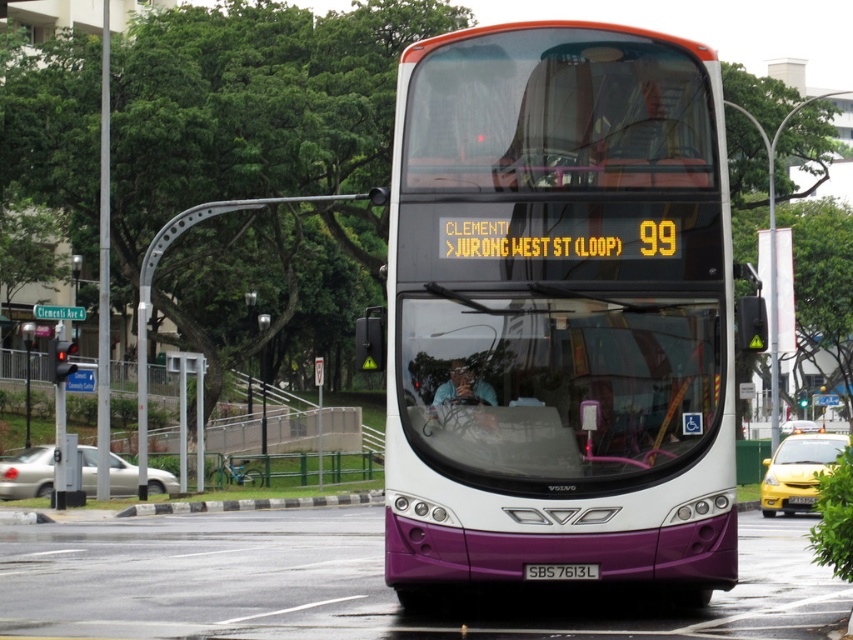
From the picture: Between purple matte bus at center and purple matte license plate at center, which one has less height?

Standing shorter between the two is purple matte license plate at center.

Does point (643, 310) come in front of point (527, 572)?

No, (643, 310) is further to viewer.

Locate an element on the screen. This screenshot has width=853, height=640. purple matte bus at center is located at coordinates (560, 310).

Which is more to the left, purple matte bus at center or black rubber curb at lower center?

black rubber curb at lower center is more to the left.

Is point (608, 80) positioned behind point (128, 509)?

That is False.

Where is `purple matte bus at center`? purple matte bus at center is located at coordinates (560, 310).

At what (x,y) coordinates should I click in order to perform the action: click on purple matte bus at center. Please return your answer as a coordinate pair (x, y). Image resolution: width=853 pixels, height=640 pixels. Looking at the image, I should click on (560, 310).

This screenshot has height=640, width=853. In order to click on black rubber curb at lower center in this screenshot , I will do `click(251, 502)`.

Can you confirm if black rubber curb at lower center is thinner than purple matte license plate at center?

In fact, black rubber curb at lower center might be wider than purple matte license plate at center.

I want to click on black rubber curb at lower center, so click(x=251, y=502).